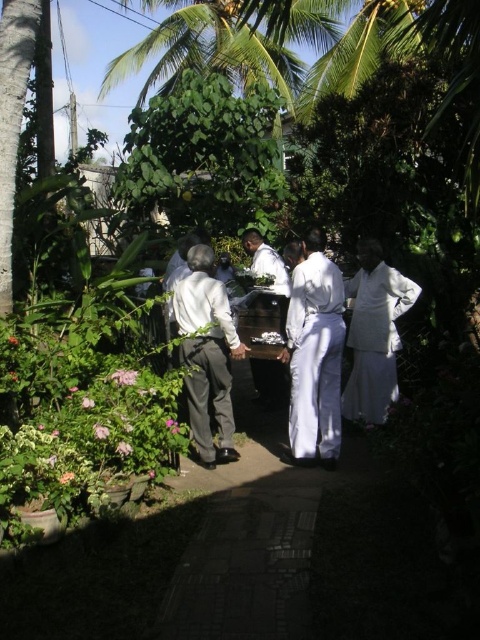
Which is more to the right, white matte shirt at center or white clothed man at center?

white clothed man at center

Is point (226, 337) behind point (276, 368)?

No, (226, 337) is in front of (276, 368).

Where is `white matte shirt at center`? Image resolution: width=480 pixels, height=640 pixels. white matte shirt at center is located at coordinates (206, 358).

Is white matte shirt at center to the left of white silk robe at right from the viewer's perspective?

Correct, you'll find white matte shirt at center to the left of white silk robe at right.

Can you confirm if white matte shirt at center is wider than white silk robe at right?

In fact, white matte shirt at center might be narrower than white silk robe at right.

This screenshot has width=480, height=640. What are the coordinates of `white matte shirt at center` in the screenshot? It's located at (206, 358).

Where is `white matte shirt at center`? Image resolution: width=480 pixels, height=640 pixels. white matte shirt at center is located at coordinates [x=206, y=358].

Does white cotton robe at center appear on the right side of white silk robe at right?

Incorrect, white cotton robe at center is not on the right side of white silk robe at right.

From the picture: Is white cotton robe at center wider than white silk robe at right?

Incorrect, white cotton robe at center's width does not surpass white silk robe at right's.

Measure the distance between white cotton robe at center and camera.

They are 5.08 meters apart.

Where is `white cotton robe at center`? white cotton robe at center is located at coordinates (314, 356).